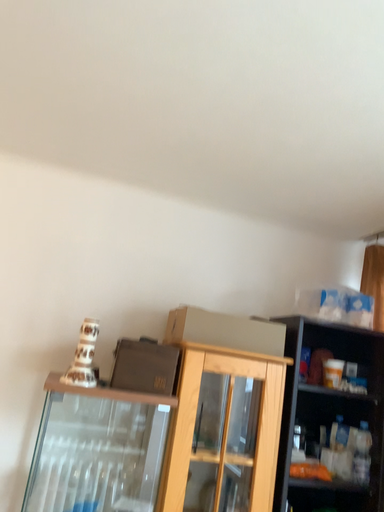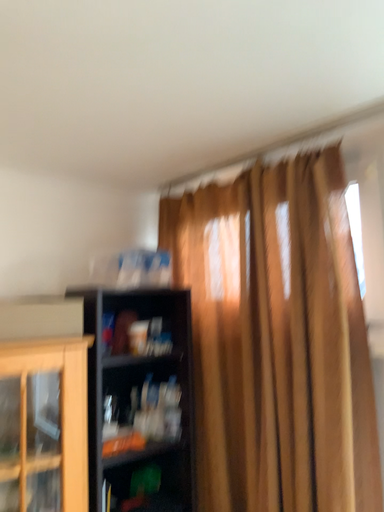
Question: How did the camera likely rotate when shooting the video?

Choices:
 (A) rotated left
 (B) rotated right

Answer: (B)